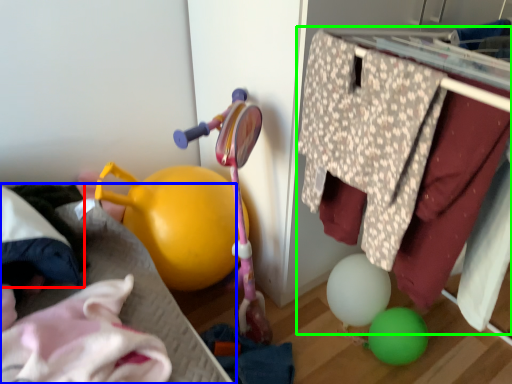
Question: Considering the real-world distances, which object is farthest from clothing (highlighted by a red box)? bed frame (highlighted by a blue box) or closet (highlighted by a green box)?

Choices:
 (A) bed frame
 (B) closet

Answer: (B)